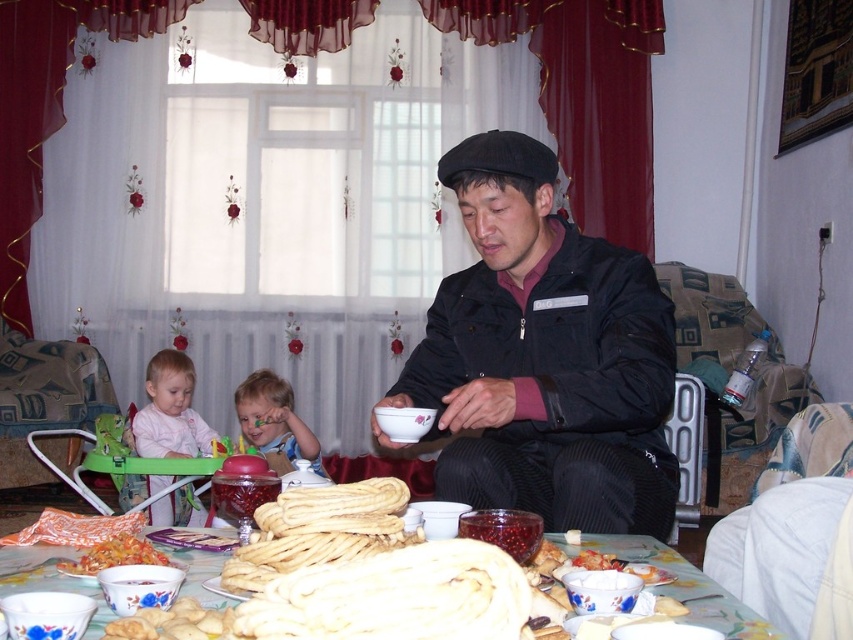
Question: Does golden doughnut at center appear under white ceramic table at lower center?

Choices:
 (A) yes
 (B) no

Answer: (B)

Question: Can you confirm if golden crispy breadsticks at center is bigger than light pink fabric baby at left?

Choices:
 (A) no
 (B) yes

Answer: (A)

Question: Can you confirm if light pink fabric baby at left is positioned above smooth plastic spoon at center?

Choices:
 (A) yes
 (B) no

Answer: (B)

Question: Which is nearer to the white ceramic table at lower center?

Choices:
 (A) golden doughnut at center
 (B) matte ceramic bowl at lower left
 (C) golden crispy breadsticks at center
 (D) matte black jacket at center

Answer: (B)

Question: Which point is closer to the camera?

Choices:
 (A) smooth plastic spoon at center
 (B) golden crispy breadsticks at center
 (C) golden doughnut at center

Answer: (C)

Question: Estimate the real-world distances between objects in this image. Which object is closer to the matte ceramic bowl at lower left?

Choices:
 (A) light pink fabric baby at left
 (B) white ceramic table at lower center
 (C) matte black jacket at center

Answer: (B)